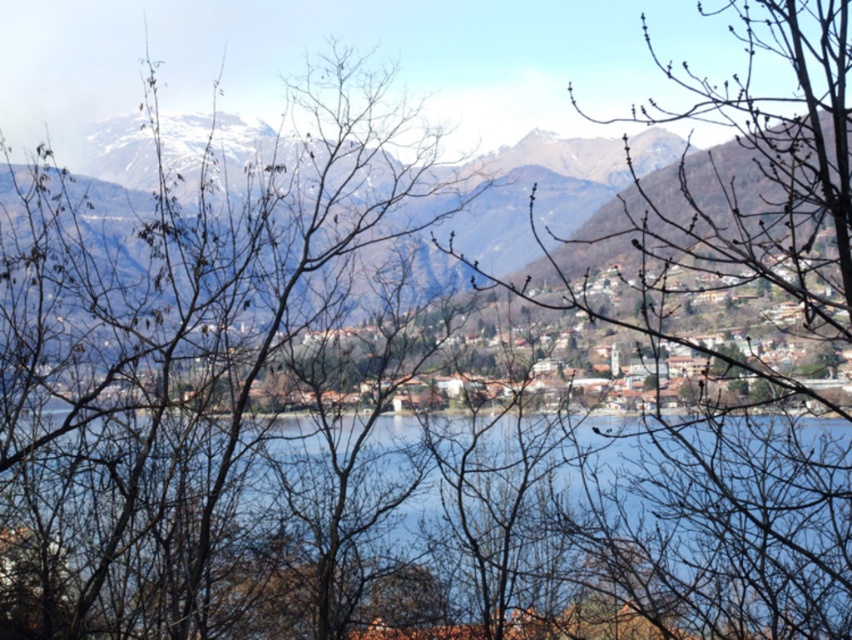
Question: Is blue water at center further to camera compared to snowy rocky mountain at center?

Choices:
 (A) yes
 (B) no

Answer: (B)

Question: Can you confirm if blue water at center is positioned to the right of snowy rocky mountain at center?

Choices:
 (A) yes
 (B) no

Answer: (A)

Question: Is blue water at center further to the viewer compared to snowy rocky mountain at center?

Choices:
 (A) no
 (B) yes

Answer: (A)